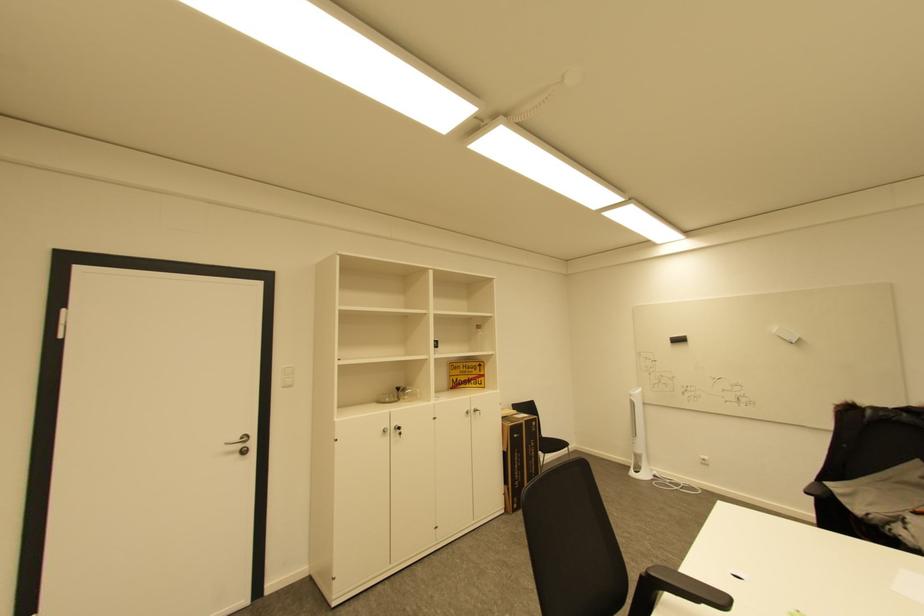
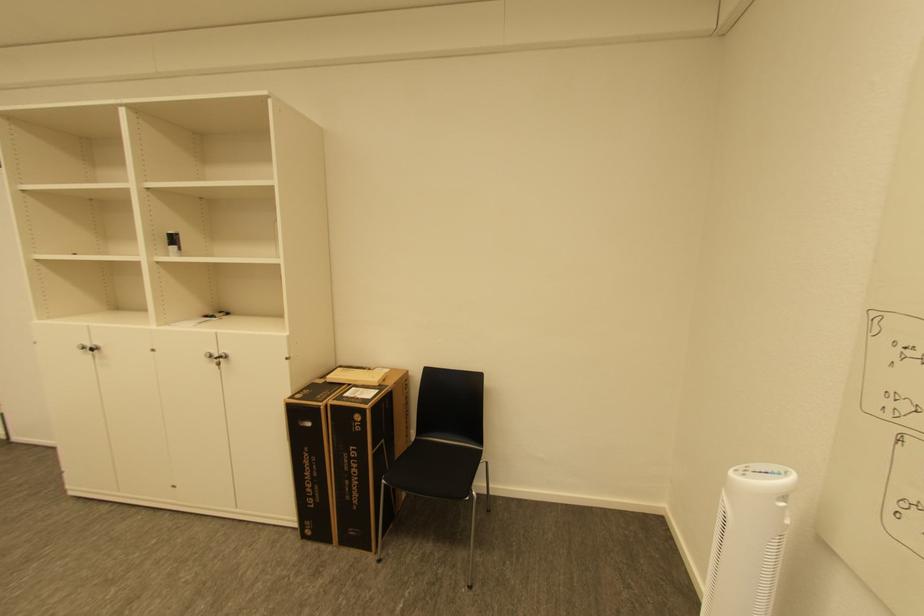
Find the pixel in the second image that matches (x=540, y=424) in the first image.

(363, 418)